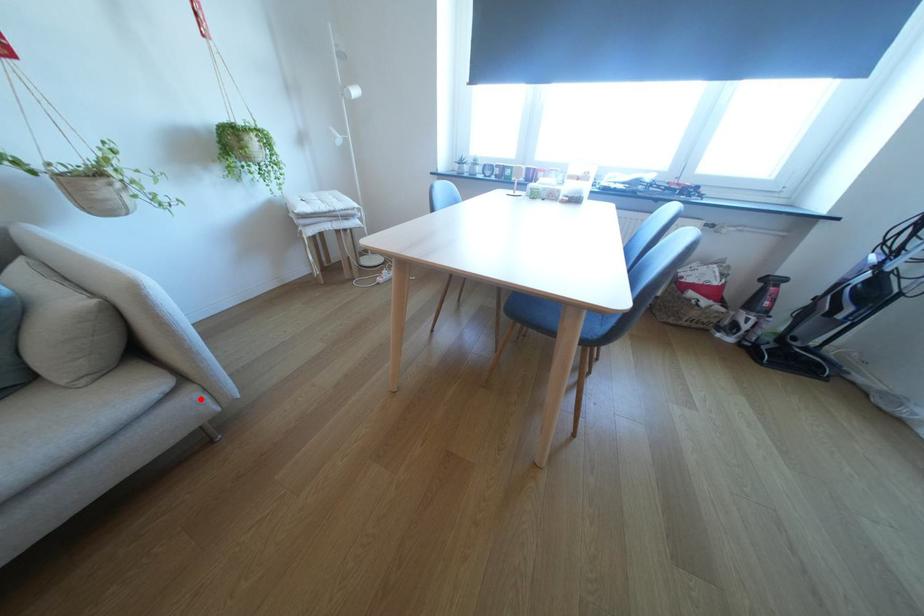
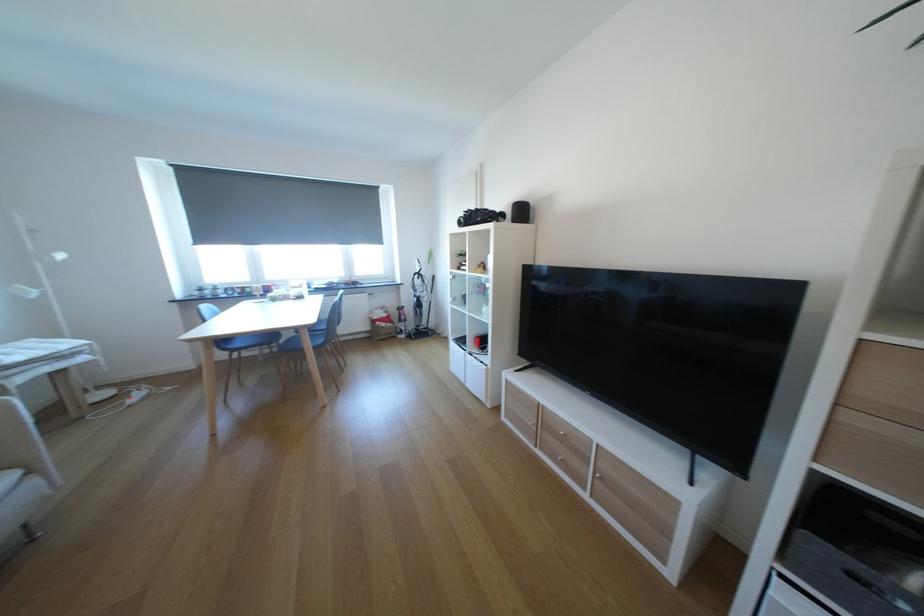
Question: I am providing you with two images of the same scene from different viewpoints. Image1 has a red point marked. In image2, the corresponding 3D location appears at what relative position? Reply with the corresponding letter.

Choices:
 (A) Closer
 (B) Farther

Answer: (B)